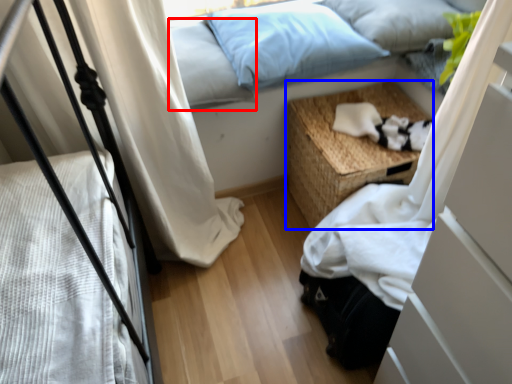
Question: Which point is further to the camera, pillow (highlighted by a red box) or nightstand (highlighted by a blue box)?

Choices:
 (A) pillow
 (B) nightstand

Answer: (B)